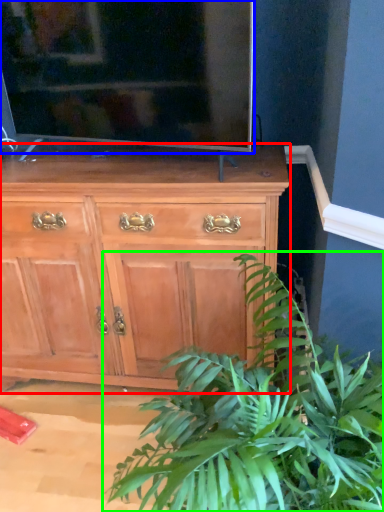
Question: Which object is the farthest from chest of drawers (highlighted by a red box)? Choose among these: television (highlighted by a blue box) or houseplant (highlighted by a green box).

Choices:
 (A) television
 (B) houseplant

Answer: (B)